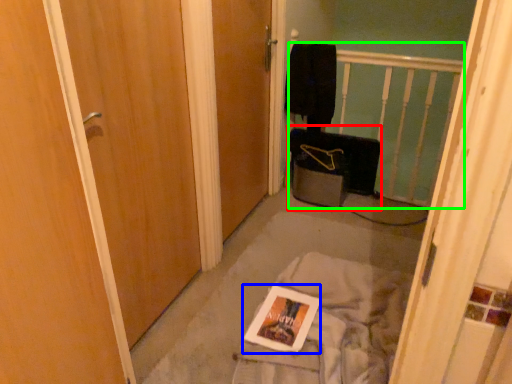
Question: Estimate the real-world distances between objects in this image. Which object is closer to luggage (highlighted by a red box), magazine (highlighted by a blue box) or balustrade (highlighted by a green box)?

Choices:
 (A) magazine
 (B) balustrade

Answer: (B)